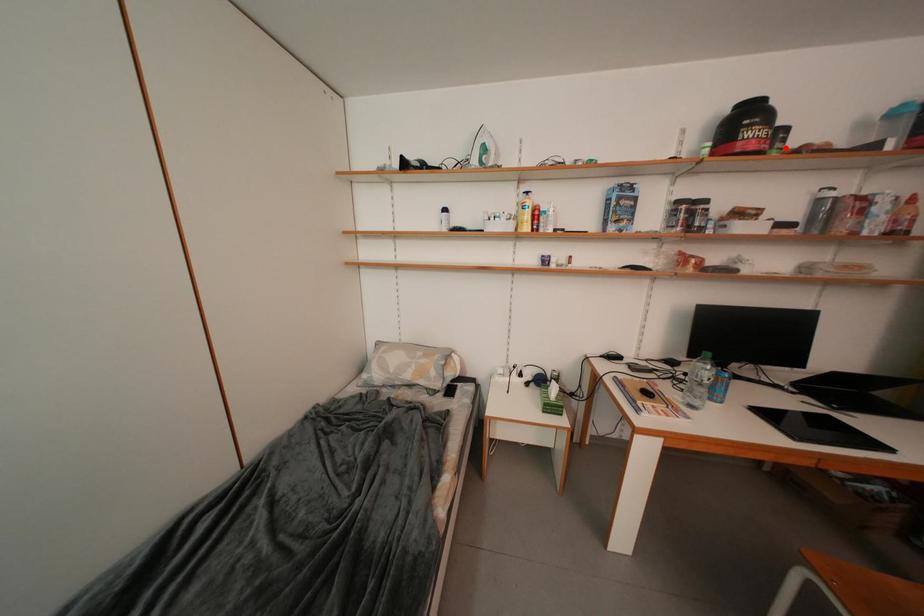
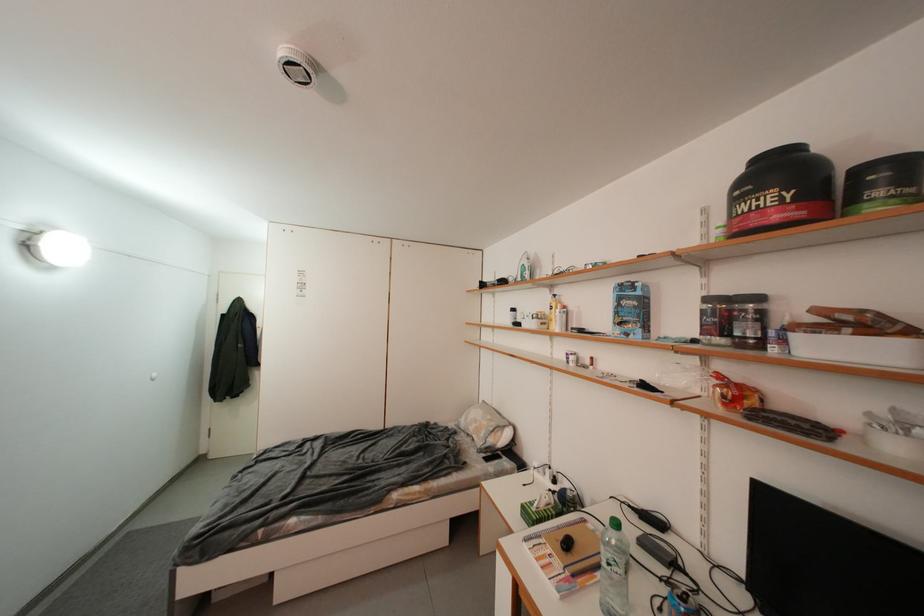
Locate, in the second image, the point that corresponds to the highlighted location in the first image.

(886, 196)